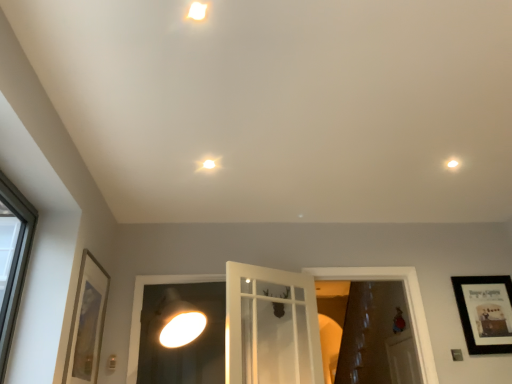
Question: From a real-world perspective, does white glass door at center, positioned as the second window frame in right-to-left order, sit lower than white glossy droplight at upper right, which is counted as the second droplight, starting from the bottom?

Choices:
 (A) yes
 (B) no

Answer: (A)

Question: Does white glass door at center, positioned as the second window frame in right-to-left order, have a larger size compared to white glossy droplight at upper right, the 2th droplight viewed from the top?

Choices:
 (A) yes
 (B) no

Answer: (A)

Question: Does white glass door at center, positioned as the second window frame in right-to-left order, appear on the right side of white glossy droplight at upper right, marked as the 3th droplight in a front-to-back arrangement?

Choices:
 (A) no
 (B) yes

Answer: (A)

Question: Is white glass door at center, positioned as the second window frame in right-to-left order, positioned before white glossy droplight at upper right, the 3th droplight viewed from the left?

Choices:
 (A) yes
 (B) no

Answer: (B)

Question: Is white glass door at center, positioned as the second window frame in right-to-left order, thinner than white glossy droplight at upper right, which is counted as the second droplight, starting from the bottom?

Choices:
 (A) yes
 (B) no

Answer: (A)

Question: From the image's perspective, is white glossy droplight at upper center, the third droplight positioned from the back, positioned above or below white glossy door at center, positioned as the 1th window frame in right-to-left order?

Choices:
 (A) below
 (B) above

Answer: (B)

Question: Is point (198, 16) closer or farther from the camera than point (414, 336)?

Choices:
 (A) closer
 (B) farther

Answer: (A)

Question: Is white glossy droplight at upper center, which appears as the first droplight when viewed from the top, spatially inside white glossy door at center, positioned as the 1th window frame in right-to-left order, or outside of it?

Choices:
 (A) inside
 (B) outside

Answer: (B)

Question: Relative to white glossy door at center, positioned as the 1th window frame in right-to-left order, is white glossy droplight at upper center, the third droplight positioned from the back, in front or behind?

Choices:
 (A) behind
 (B) front

Answer: (B)

Question: Considering the positions of gold-framed picture at left, which is counted as the 1th picture frame, starting from the front, and white glossy door at center, placed as the second window frame when sorted from left to right, in the image, is gold-framed picture at left, which is counted as the 1th picture frame, starting from the front, taller or shorter than white glossy door at center, placed as the second window frame when sorted from left to right,?

Choices:
 (A) short
 (B) tall

Answer: (A)

Question: From the image's perspective, is gold-framed picture at left, the 2th picture frame positioned from the back, above or below white glossy door at center, positioned as the 1th window frame in right-to-left order?

Choices:
 (A) below
 (B) above

Answer: (B)

Question: Considering the relative positions of gold-framed picture at left, which is counted as the 1th picture frame, starting from the front, and white glossy door at center, placed as the second window frame when sorted from left to right, in the image provided, is gold-framed picture at left, which is counted as the 1th picture frame, starting from the front, to the left or to the right of white glossy door at center, placed as the second window frame when sorted from left to right,?

Choices:
 (A) right
 (B) left

Answer: (B)

Question: Is gold-framed picture at left, positioned as the 2th picture frame in right-to-left order, in front of or behind white glossy door at center, placed as the second window frame when sorted from left to right, in the image?

Choices:
 (A) front
 (B) behind

Answer: (A)

Question: From a real-world perspective, relative to white glossy droplight at upper right, the 1th droplight viewed from the right, is black matte picture frame at upper right, which is counted as the first picture frame, starting from the right, vertically above or below?

Choices:
 (A) below
 (B) above

Answer: (A)

Question: In terms of height, does black matte picture frame at upper right, which ranks as the second picture frame in front-to-back order, look taller or shorter compared to white glossy droplight at upper right, the 1th droplight viewed from the right?

Choices:
 (A) short
 (B) tall

Answer: (B)